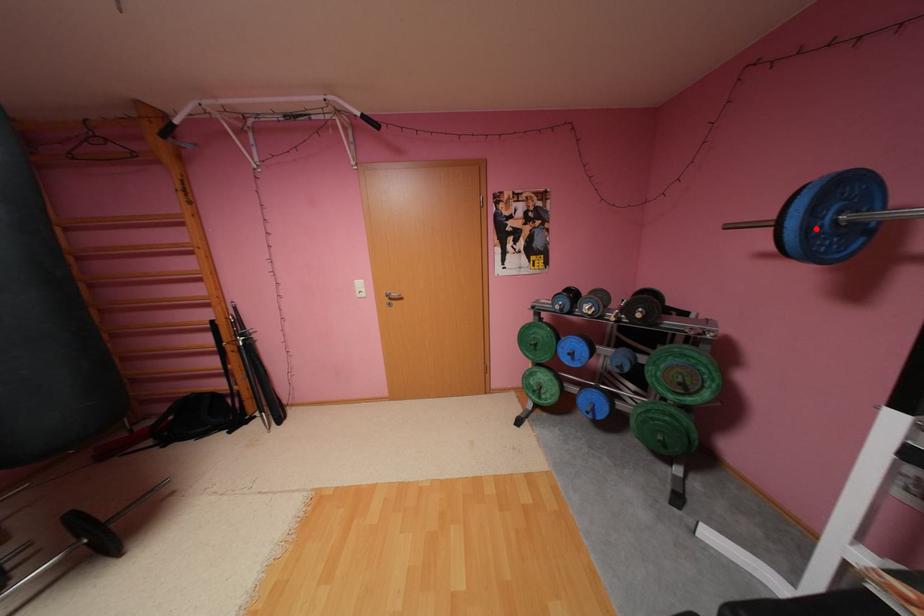
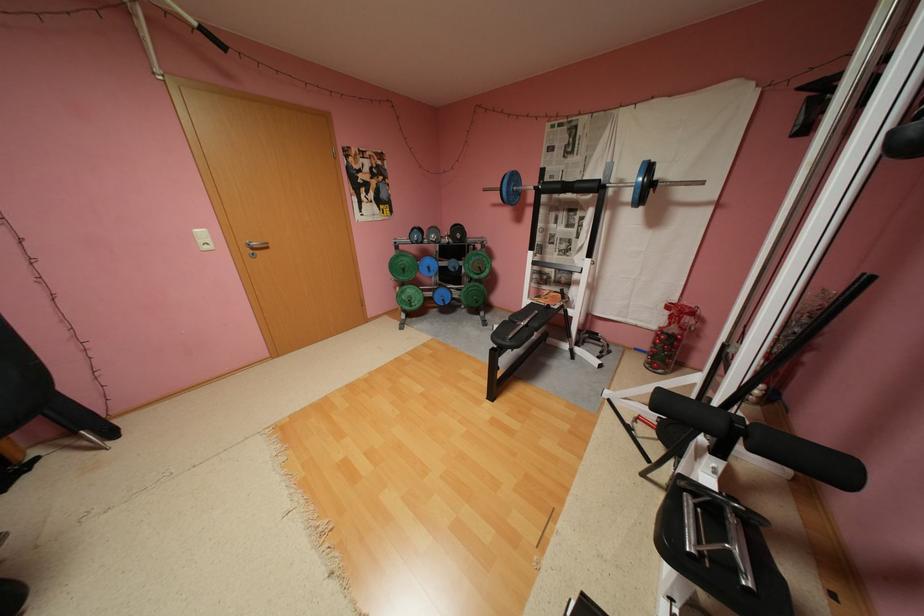
Locate, in the second image, the point that corresponds to the highlighted location in the first image.

(517, 191)